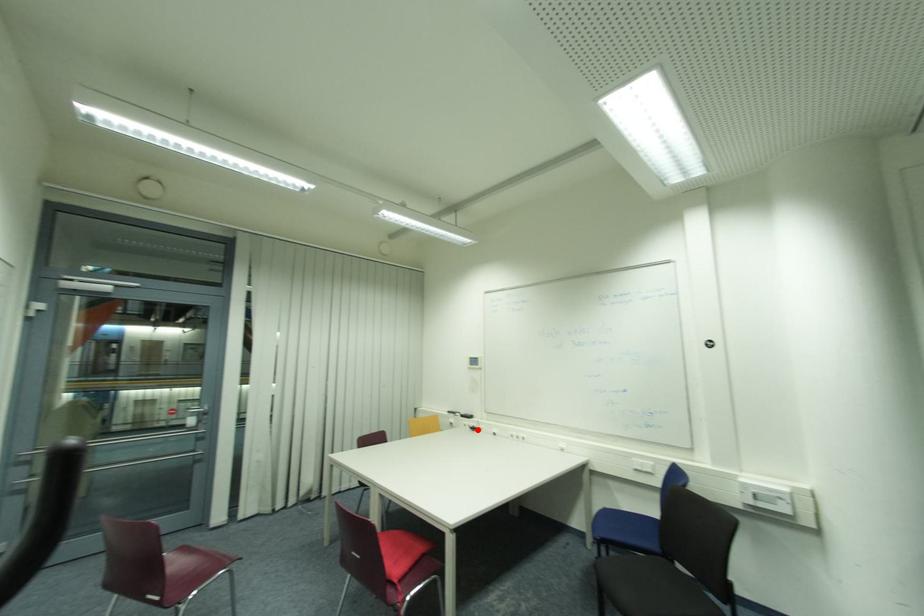
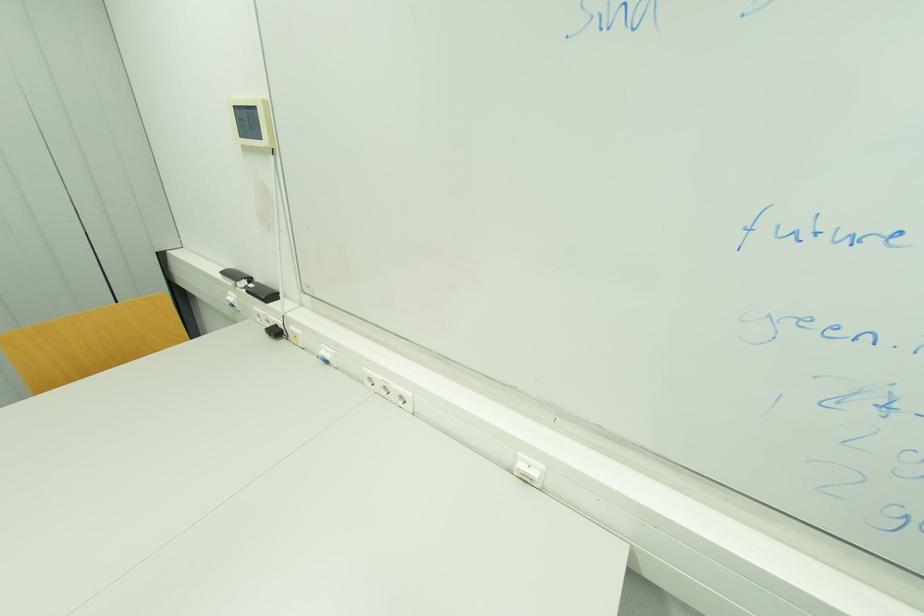
Question: I am providing you with two images of the same scene from different viewpoints. In image1, a red point is highlighted. Considering the same 3D point in image2, which of the following is correct?

Choices:
 (A) It is closer
 (B) It is farther

Answer: (A)